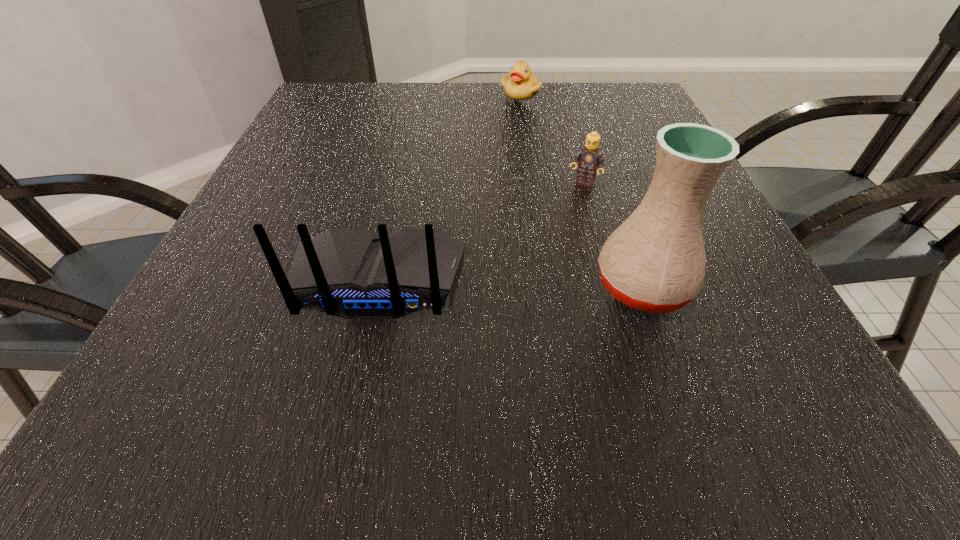
Where is `object that is at the near left corner`? The width and height of the screenshot is (960, 540). object that is at the near left corner is located at coordinates (351, 273).

The width and height of the screenshot is (960, 540). In order to click on object present at the near right corner in this screenshot , I will do `click(655, 261)`.

In the image, there is a desktop. Where is `free space at the far edge`? free space at the far edge is located at coordinates (386, 87).

You are a GUI agent. You are given a task and a screenshot of the screen. Output one action in this format:
    pyautogui.click(x=<x>, y=<y>)
    Task: Click on the vacant space at the near edge of the desktop
    
    Given the screenshot: What is the action you would take?
    pyautogui.click(x=621, y=339)

I want to click on vacant space at the left edge of the desktop, so click(253, 196).

In the image, there is a desktop. At what (x,y) coordinates should I click in order to perform the action: click on blank space at the right edge. Please return your answer as a coordinate pair (x, y). The image size is (960, 540). Looking at the image, I should click on (634, 126).

Locate an element on the screen. This screenshot has width=960, height=540. vacant space at the far left corner is located at coordinates (367, 93).

Where is `vacant region at the far right corner`? The height and width of the screenshot is (540, 960). vacant region at the far right corner is located at coordinates (624, 107).

The height and width of the screenshot is (540, 960). I want to click on vacant region at the near right corner, so click(765, 336).

Where is `empty space between the second tallest object and the shortest object`? The image size is (960, 540). empty space between the second tallest object and the shortest object is located at coordinates (450, 187).